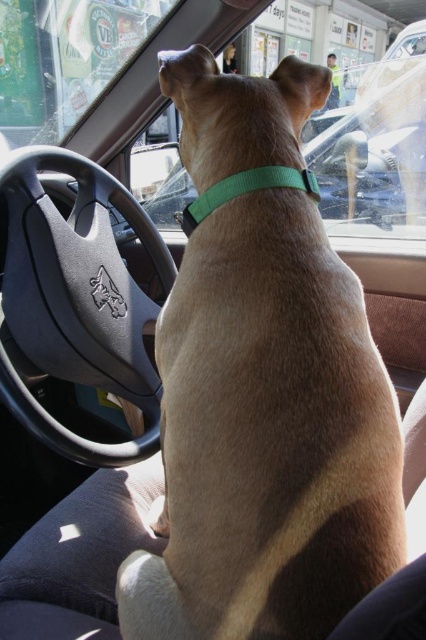
Is brown matte dog at center smaller than green fabric neckband at center?

No.

Consider the image. Can you confirm if brown matte dog at center is thinner than green fabric neckband at center?

No, brown matte dog at center is not thinner than green fabric neckband at center.

Which is in front, point (167, 570) or point (291, 184)?

Positioned in front is point (167, 570).

Find the location of `brown matte dog at center`. brown matte dog at center is located at coordinates (267, 436).